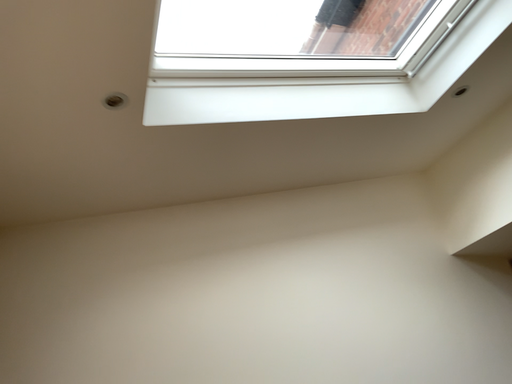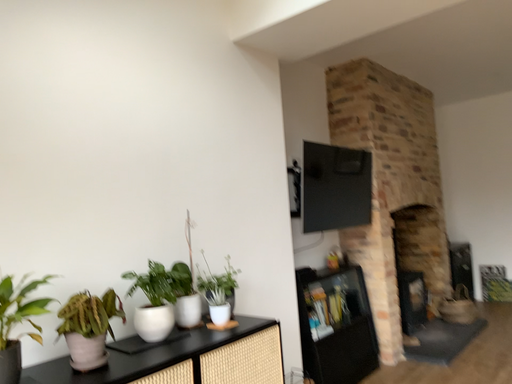
Question: Which way did the camera rotate in the video?

Choices:
 (A) rotated downward
 (B) rotated upward

Answer: (A)